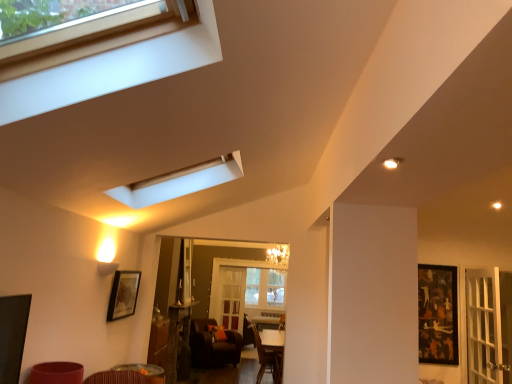
Question: In the image, is clear glass screen door at center positioned in front of or behind dark brown leather armchair at center?

Choices:
 (A) behind
 (B) front

Answer: (A)

Question: Choose the correct answer: Is clear glass screen door at center inside dark brown leather armchair at center or outside it?

Choices:
 (A) inside
 (B) outside

Answer: (B)

Question: Considering the real-world distances, which object is farthest from the matte black picture frame at lower left, acting as the 1th picture frame starting from the left?

Choices:
 (A) clear glass screen door at center
 (B) black glossy picture frame at right, which is the 1th picture frame from back to front
 (C) wooden table at center, the 1th table in the back-to-front sequence
 (D) brown leather chair at lower center
 (E) wooden table at lower center, positioned as the 2th table in bottom-to-top order

Answer: (B)

Question: Estimate the real-world distances between objects in this image. Which object is closer to the matte black picture frame at lower left, the second picture frame when ordered from back to front?

Choices:
 (A) wooden table at center, which is counted as the 2th table, starting from the front
 (B) black glossy picture frame at right, marked as the 2th picture frame in a left-to-right arrangement
 (C) dark brown leather armchair at center
 (D) clear glass screen door at center
 (E) wooden table at lower center, positioned as the 2th table in bottom-to-top order

Answer: (E)